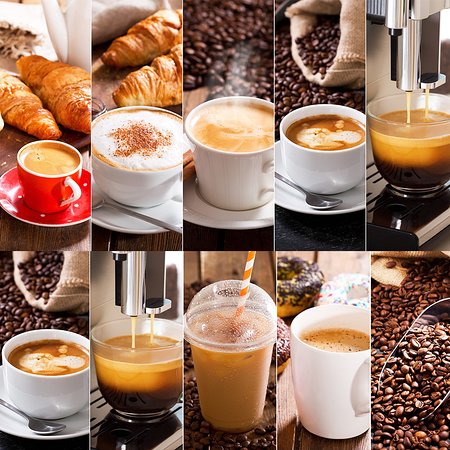
The height and width of the screenshot is (450, 450). Identify the location of total amount of clear cups plus spoons. (167, 224), (319, 198), (41, 428), (144, 360), (216, 347), (415, 169).